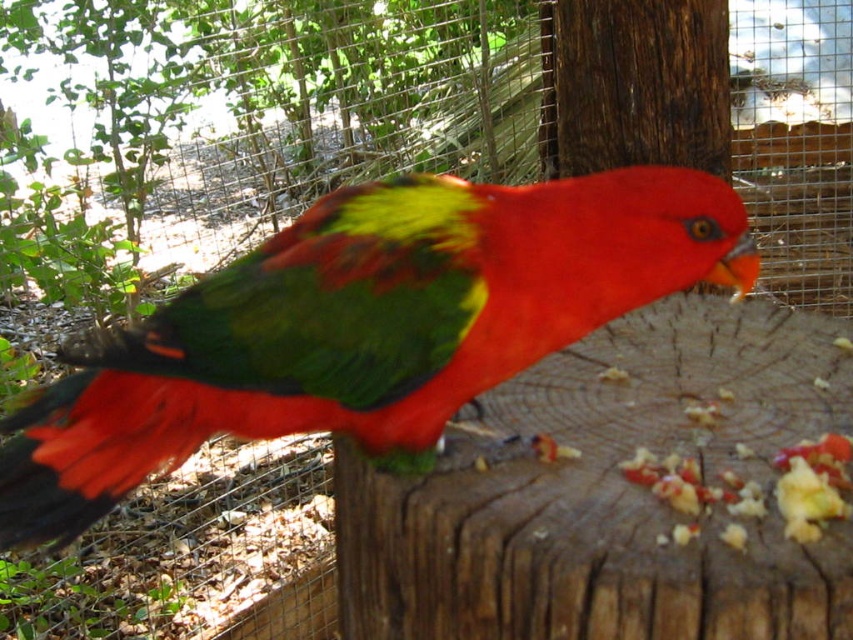
Can you confirm if shiny green parrot at center is shorter than brown rough tree trunk at center?

Correct, shiny green parrot at center is not as tall as brown rough tree trunk at center.

Is shiny green parrot at center smaller than brown rough tree trunk at center?

Correct, shiny green parrot at center occupies less space than brown rough tree trunk at center.

Which is in front, point (292, 307) or point (621, 157)?

Point (292, 307)

Find the location of a particular element. The height and width of the screenshot is (640, 853). shiny green parrot at center is located at coordinates (363, 326).